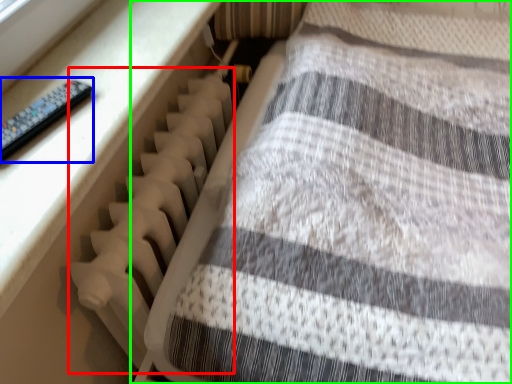
Question: Which object is positioned farthest from radiator (highlighted by a red box)? Select from control (highlighted by a blue box) and furniture (highlighted by a green box).

Choices:
 (A) control
 (B) furniture

Answer: (A)